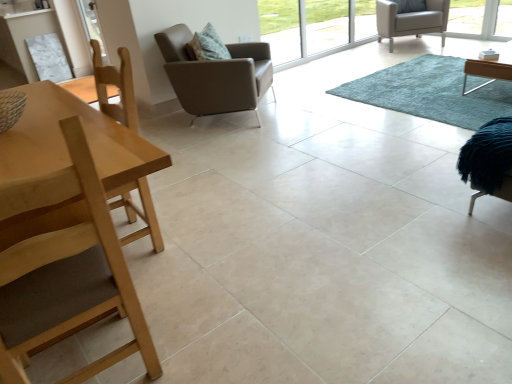
What do you see at coordinates (307, 29) in the screenshot? This screenshot has height=384, width=512. I see `transparent glass window at upper center` at bounding box center [307, 29].

Identify the location of transparent glass screen door at upper left. (92, 25).

The width and height of the screenshot is (512, 384). Describe the element at coordinates (65, 269) in the screenshot. I see `light wood chair at left, positioned as the third chair in top-to-bottom order` at that location.

This screenshot has height=384, width=512. What do you see at coordinates (411, 20) in the screenshot?
I see `light brown leather armchair at upper right, placed as the first chair when sorted from back to front` at bounding box center [411, 20].

Where is `transparent glass window at upper center`? transparent glass window at upper center is located at coordinates (307, 29).

From the image's perspective, is transparent glass screen door at upper left located above or below light wood chair at left, acting as the first chair starting from the bottom?

transparent glass screen door at upper left is above light wood chair at left, acting as the first chair starting from the bottom.

Is transparent glass screen door at upper left at the left side of light wood chair at left, which ranks as the first chair in front-to-back order?

Yes.

Between point (90, 13) and point (7, 273), which one is positioned in front?

The point (7, 273) is in front.

Considering the sizes of transparent glass screen door at upper left and light wood chair at left, arranged as the first chair when viewed from the left, in the image, is transparent glass screen door at upper left wider or thinner than light wood chair at left, arranged as the first chair when viewed from the left,?

Considering their sizes, transparent glass screen door at upper left looks slimmer than light wood chair at left, arranged as the first chair when viewed from the left.

Is light wood chair at left, positioned as the 3th chair in right-to-left order, not within light wood table at left?

That's correct, light wood chair at left, positioned as the 3th chair in right-to-left order, is outside of light wood table at left.

Is light wood chair at left, which ranks as the first chair in front-to-back order, in front of or behind light wood table at left in the image?

light wood chair at left, which ranks as the first chair in front-to-back order, is in front of light wood table at left.

Which point is more distant from viewer, (x=104, y=212) or (x=22, y=236)?

The point (x=22, y=236) is behind.

Where is `table above the light wood chair at left, positioned as the third chair in top-to-bottom order (from the image's perspective)`? The width and height of the screenshot is (512, 384). table above the light wood chair at left, positioned as the third chair in top-to-bottom order (from the image's perspective) is located at coordinates point(65,144).

Between point (292, 51) and point (158, 363), which one is positioned behind?

Point (292, 51)

In the scene shown: From the image's perspective, is transparent glass window at upper center located above or below light wood chair at left, acting as the first chair starting from the bottom?

From the image's perspective, transparent glass window at upper center appears above light wood chair at left, acting as the first chair starting from the bottom.

Is transparent glass window at upper center positioned with its back to light wood chair at left, positioned as the 3th chair in right-to-left order?

transparent glass window at upper center is not turned away from light wood chair at left, positioned as the 3th chair in right-to-left order.

Which object is further away from the camera taking this photo, blue shaggy rug at center or transparent glass window at upper center?

transparent glass window at upper center is further away from the camera.

Can you see blue shaggy rug at center touching transparent glass window at upper center?

No, blue shaggy rug at center is not beside transparent glass window at upper center.

From a real-world perspective, which object rests below the other?

blue shaggy rug at center is physically lower.

Can you confirm if blue shaggy rug at center is smaller than transparent glass window at upper center?

No, blue shaggy rug at center is not smaller than transparent glass window at upper center.

Can you confirm if light wood table at left is wider than blue shaggy rug at center?

In fact, light wood table at left might be narrower than blue shaggy rug at center.

Considering the positions of objects light wood table at left and blue shaggy rug at center in the image provided, who is in front, light wood table at left or blue shaggy rug at center?

light wood table at left.

Which of these two, light wood table at left or blue shaggy rug at center, stands taller?

light wood table at left is taller.

Does light wood table at left turn towards blue shaggy rug at center?

No, light wood table at left is not turned towards blue shaggy rug at center.

Is leather-like brown armchair at center, the second chair in the top-to-bottom sequence, looking in the opposite direction of transparent glass window at upper center?

leather-like brown armchair at center, the second chair in the top-to-bottom sequence, is not turned away from transparent glass window at upper center.

Between leather-like brown armchair at center, the second chair in the top-to-bottom sequence, and transparent glass window at upper center, which one has larger width?

With larger width is leather-like brown armchair at center, the second chair in the top-to-bottom sequence.

In terms of height, does leather-like brown armchair at center, the second chair when ordered from right to left, look taller or shorter compared to transparent glass window at upper center?

leather-like brown armchair at center, the second chair when ordered from right to left, is shorter than transparent glass window at upper center.

Which is behind, point (455, 69) or point (139, 146)?

The point (455, 69) is farther from the camera.

How many degrees apart are the facing directions of blue shaggy rug at center and light wood table at left?

1.3 degrees separate the facing orientations of blue shaggy rug at center and light wood table at left.

Which is behind, blue shaggy rug at center or light wood table at left?

blue shaggy rug at center is further away from the camera.

Where is `screen door on the left of light wood chair at left, acting as the first chair starting from the bottom`? The width and height of the screenshot is (512, 384). screen door on the left of light wood chair at left, acting as the first chair starting from the bottom is located at coordinates (92, 25).

Find the location of a particular element. The width and height of the screenshot is (512, 384). table behind the light wood chair at left, positioned as the third chair in top-to-bottom order is located at coordinates (65, 144).

Based on their spatial positions, is transparent glass screen door at upper left or leather-like brown armchair at center, which ranks as the 2th chair in back-to-front order, further from light wood chair at left, positioned as the third chair in top-to-bottom order?

transparent glass screen door at upper left lies further to light wood chair at left, positioned as the third chair in top-to-bottom order, than the other object.

Estimate the real-world distances between objects in this image. Which object is closer to light brown leather armchair at upper right, the 1th chair when ordered from top to bottom, light wood chair at left, acting as the first chair starting from the bottom, or light wood table at left?

Based on the image, light wood table at left appears to be nearer to light brown leather armchair at upper right, the 1th chair when ordered from top to bottom.

Looking at the image, which one is located closer to light wood chair at left, arranged as the first chair when viewed from the left, light brown leather armchair at upper right, which appears as the 1th chair when viewed from the right, or transparent glass screen door at upper left?

Based on the image, transparent glass screen door at upper left appears to be nearer to light wood chair at left, arranged as the first chair when viewed from the left.

When comparing their distances from leather-like brown armchair at center, which ranks as the 2th chair in back-to-front order, does transparent glass screen door at upper left or transparent glass window at upper center seem further?

transparent glass window at upper center is further to leather-like brown armchair at center, which ranks as the 2th chair in back-to-front order.

Based on their spatial positions, is leather-like brown armchair at center, the second chair in the top-to-bottom sequence, or transparent glass window at upper center closer to blue shaggy rug at center?

leather-like brown armchair at center, the second chair in the top-to-bottom sequence, is positioned closer to the anchor blue shaggy rug at center.

Looking at the image, which one is located closer to transparent glass window at upper center, transparent glass screen door at upper left or blue shaggy rug at center?

The object closer to transparent glass window at upper center is blue shaggy rug at center.

Which object lies further to the anchor point transparent glass screen door at upper left, leather-like brown armchair at center, the 2th chair from the front, or blue shaggy rug at center?

The object further to transparent glass screen door at upper left is blue shaggy rug at center.

Based on their spatial positions, is blue shaggy rug at center or transparent glass window at upper center closer to transparent glass screen door at upper left?

The object closer to transparent glass screen door at upper left is transparent glass window at upper center.

Identify the location of table between light wood chair at left, positioned as the 3th chair in right-to-left order, and transparent glass screen door at upper left from front to back. (65, 144).

Where is `table between light wood chair at left, marked as the 3th chair in a back-to-front arrangement, and transparent glass window at upper center, along the z-axis`? This screenshot has height=384, width=512. table between light wood chair at left, marked as the 3th chair in a back-to-front arrangement, and transparent glass window at upper center, along the z-axis is located at coordinates (65, 144).

The image size is (512, 384). What are the coordinates of `window screen between light wood table at left and light brown leather armchair at upper right, placed as the first chair when sorted from back to front, along the z-axis` in the screenshot? It's located at (307, 29).

This screenshot has height=384, width=512. I want to click on window screen situated between transparent glass screen door at upper left and light brown leather armchair at upper right, the third chair in the left-to-right sequence, from left to right, so click(307, 29).